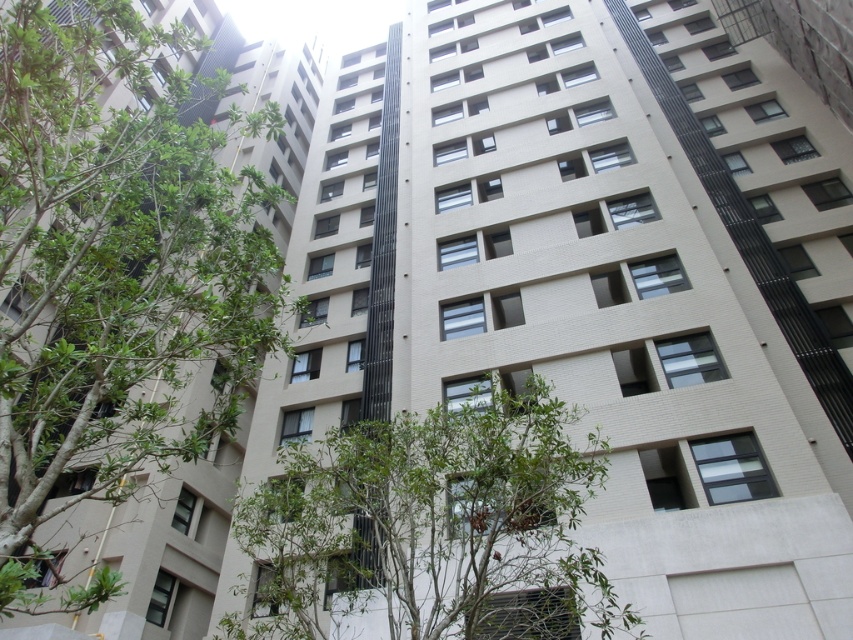
You are standing at the point marked as point (73,404). You want to walk to the entrance of the residential building. The entrance is located at the base of the building, which is 21.10 feet away from your current position. Can you reach the entrance without moving more than 25 feet?

Yes, you can reach the entrance because the distance between point (73,404) and the entrance is 21.10 feet, which is within the 25 feet limit.

You are standing in front of the residential building and notice a point marked at coordinates (115, 273). What object is located at this point?

The green leafy tree at left is located at point (115, 273).